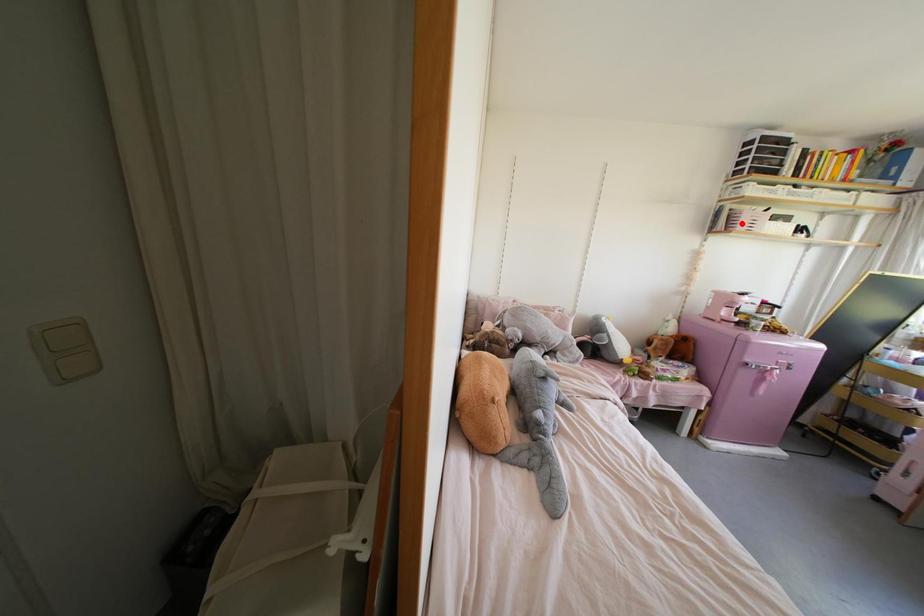
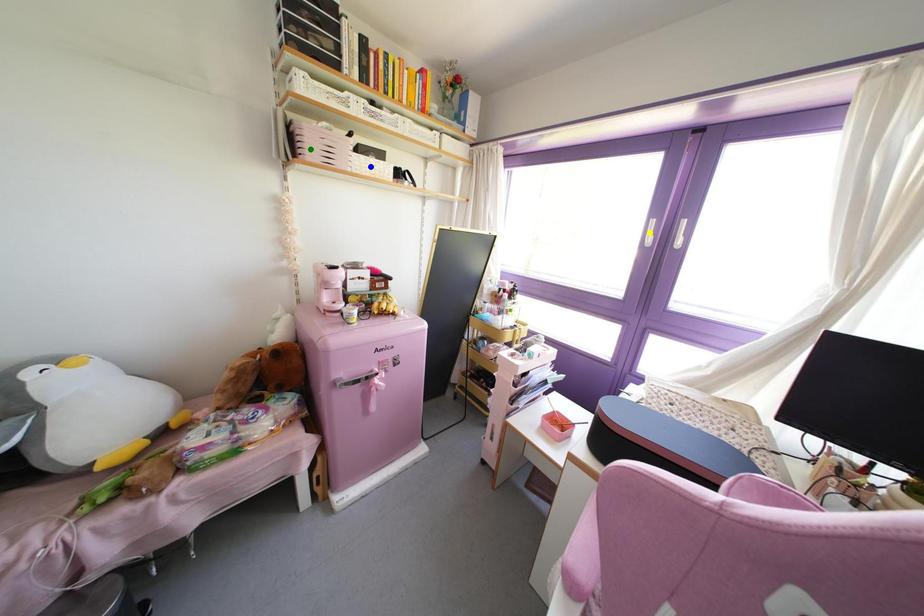
Question: I am providing you with two images of the same scene from different viewpoints. A red point is marked on the first image. You are given multiple points on the second image. Which mark in image 2 goes with the point in image 1?

Choices:
 (A) yellow point
 (B) blue point
 (C) green point

Answer: (C)